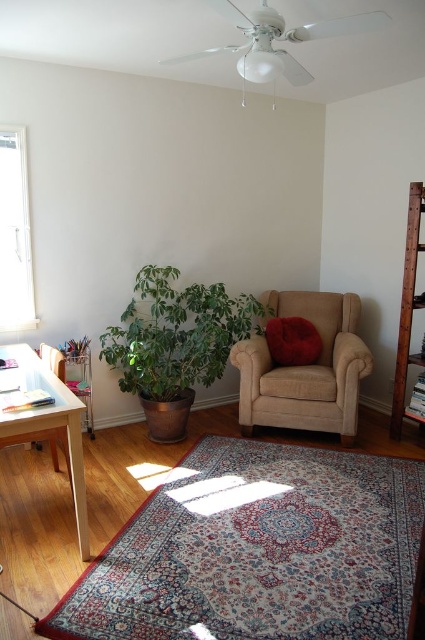
You are organizing a small plant that requires a sunny spot. You have a clear glass window at left and a light wood table at left. Which object can you place the plant near to ensure it gets enough sunlight?

The clear glass window at left is the better option for placing the plant near to ensure it gets enough sunlight, as windows typically allow more direct sunlight into a room compared to tables.

Based on the photo, you are standing in the room and want to pick up an item located at point (37, 368) and another item at point (272, 330). Which item will you reach first?

The item at point (37, 368) will be reached first because it is closer to you than the item at point (272, 330).

From the picture: You are sitting on the floor in the cozy corner and want to reach the velvet red pillow at center to fluff it up. Is the green leafy plant at lower left blocking your path to the pillow?

The green leafy plant at lower left is in front of the velvet red pillow at center, so it is blocking your path to the pillow.